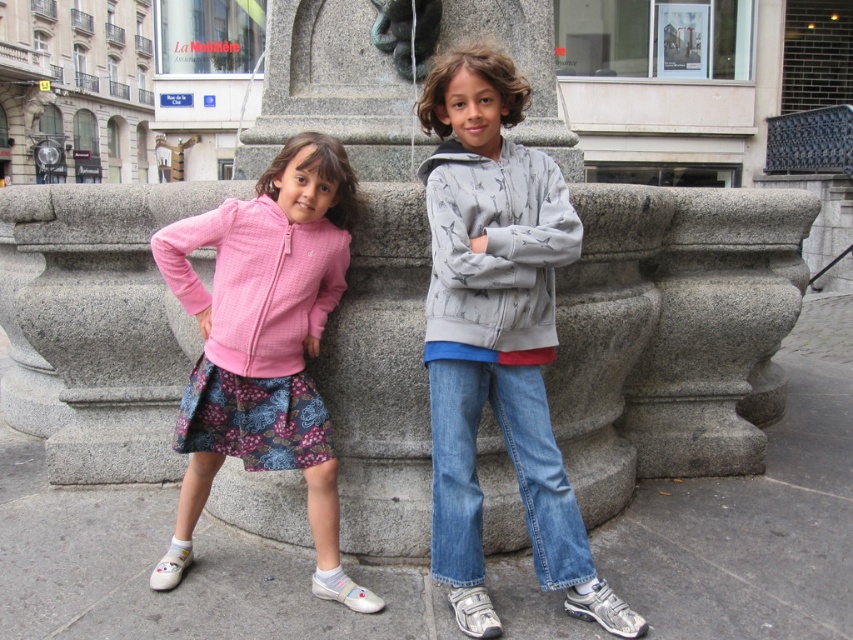
Can you confirm if gray textured hoodie at center is smaller than gray cotton sweatshirt at center?

No, gray textured hoodie at center is not smaller than gray cotton sweatshirt at center.

Measure the distance from gray textured hoodie at center to gray cotton sweatshirt at center.

The distance of gray textured hoodie at center from gray cotton sweatshirt at center is 4.03 inches.

What do you see at coordinates (497, 337) in the screenshot?
I see `gray textured hoodie at center` at bounding box center [497, 337].

Locate an element on the screen. The image size is (853, 640). gray textured hoodie at center is located at coordinates (497, 337).

Does gray cotton sweatshirt at center have a lesser height compared to matte pink sweatshirt at left?

No.

Is gray cotton sweatshirt at center to the left of matte pink sweatshirt at left from the viewer's perspective?

No, gray cotton sweatshirt at center is not to the left of matte pink sweatshirt at left.

The height and width of the screenshot is (640, 853). What do you see at coordinates (495, 252) in the screenshot?
I see `gray cotton sweatshirt at center` at bounding box center [495, 252].

What are the coordinates of `gray cotton sweatshirt at center` in the screenshot? It's located at (495, 252).

Does pink fleece jacket at center appear on the left side of gray cotton sweatshirt at center?

Yes, pink fleece jacket at center is to the left of gray cotton sweatshirt at center.

Which is more to the right, pink fleece jacket at center or gray cotton sweatshirt at center?

From the viewer's perspective, gray cotton sweatshirt at center appears more on the right side.

Where is `pink fleece jacket at center`? This screenshot has height=640, width=853. pink fleece jacket at center is located at coordinates (264, 344).